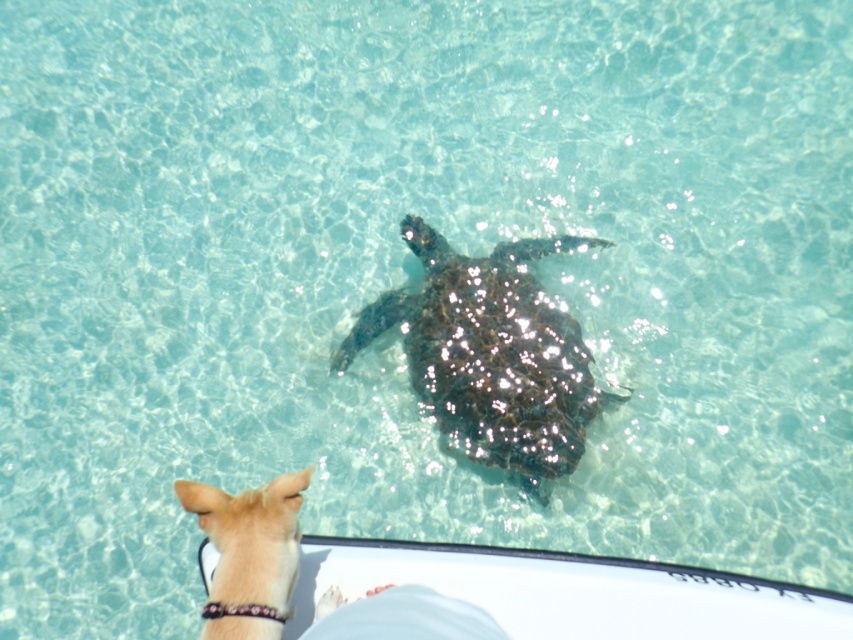
Is shiny dark brown turtle at center to the left of light brown fur at lower left from the viewer's perspective?

In fact, shiny dark brown turtle at center is to the right of light brown fur at lower left.

Which is behind, point (410, 376) or point (296, 484)?

Positioned behind is point (410, 376).

The width and height of the screenshot is (853, 640). What are the coordinates of `shiny dark brown turtle at center` in the screenshot? It's located at (491, 353).